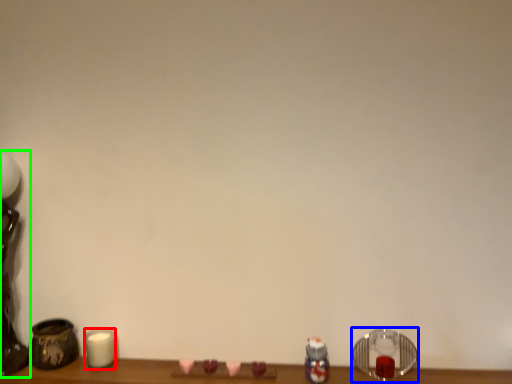
Question: Which is nearer to the candle (highlighted by a red box)? candle holder (highlighted by a blue box) or table lamp (highlighted by a green box).

Choices:
 (A) candle holder
 (B) table lamp

Answer: (B)